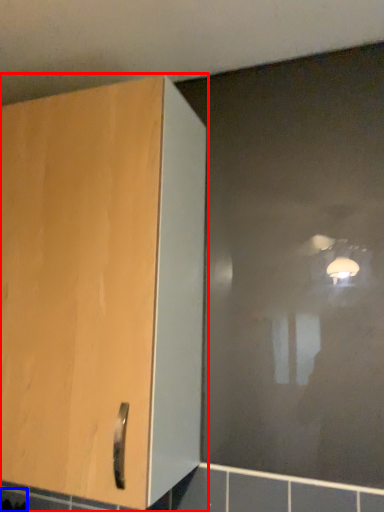
Question: Which object appears farthest to the camera in this image, cupboard (highlighted by a red box) or ceramic tile (highlighted by a blue box)?

Choices:
 (A) cupboard
 (B) ceramic tile

Answer: (B)